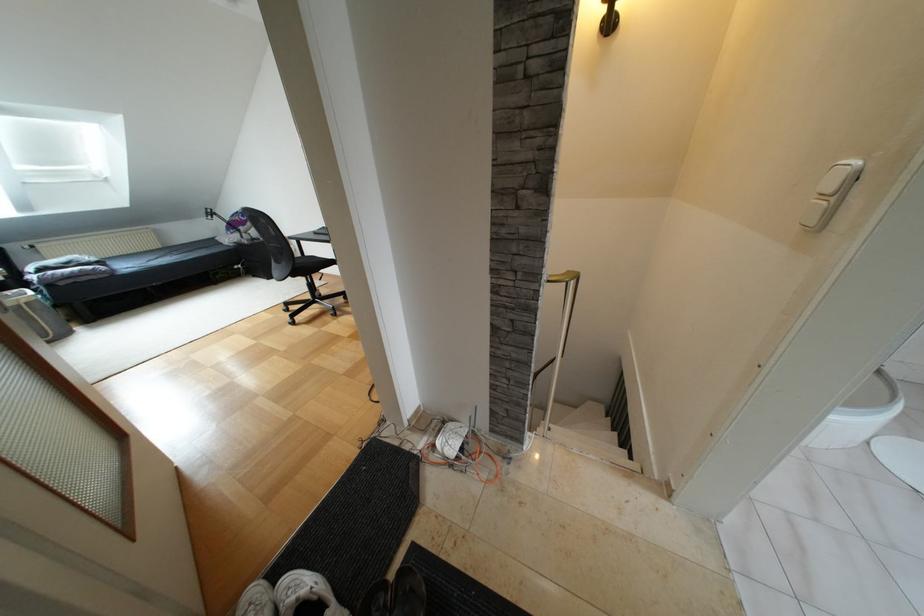
Locate an element on the screen. This screenshot has width=924, height=616. white light switch is located at coordinates tap(841, 196).